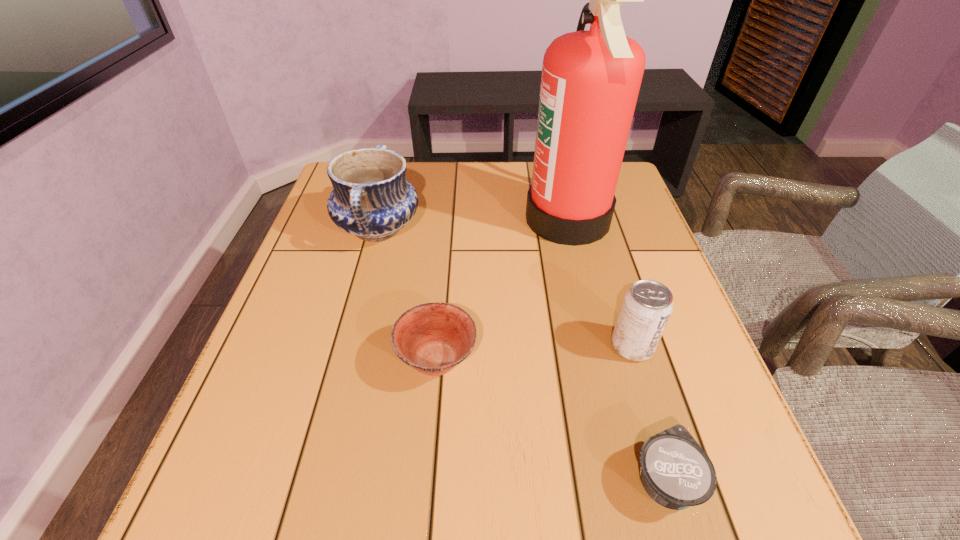
Find the location of a particular element. The width and height of the screenshot is (960, 540). free point between the second tallest object and the nearest object is located at coordinates (521, 354).

Find the location of `free space between the third tallest object and the fourth shortest object`. free space between the third tallest object and the fourth shortest object is located at coordinates [505, 287].

At what (x,y) coordinates should I click in order to perform the action: click on free space between the pottery and the yogurt. Please return your answer as a coordinate pair (x, y). Looking at the image, I should click on (521, 354).

I want to click on free space between the nearest object and the soda can, so click(648, 413).

Image resolution: width=960 pixels, height=540 pixels. I want to click on unoccupied position between the second tallest object and the fire extinguisher, so click(473, 224).

This screenshot has height=540, width=960. Identify the location of vacant point located between the soda can and the fire extinguisher. (600, 282).

In order to click on unoccupied position between the bowl and the pottery in this screenshot , I will do `click(408, 294)`.

Identify which object is the fourth closest to the bowl. Please provide its 2D coordinates. Your answer should be formatted as a tuple, i.e. [(x, y)], where the tuple contains the x and y coordinates of a point satisfying the conditions above.

[(646, 308)]

Choose which object is the fourth nearest neighbor to the fourth tallest object. Please provide its 2D coordinates. Your answer should be formatted as a tuple, i.e. [(x, y)], where the tuple contains the x and y coordinates of a point satisfying the conditions above.

[(646, 308)]

Where is `vacant space that satisfies the following two spatial constraints: 1. on the front side of the bowl; 2. on the left side of the fourth shortest object`? This screenshot has width=960, height=540. vacant space that satisfies the following two spatial constraints: 1. on the front side of the bowl; 2. on the left side of the fourth shortest object is located at coordinates (343, 360).